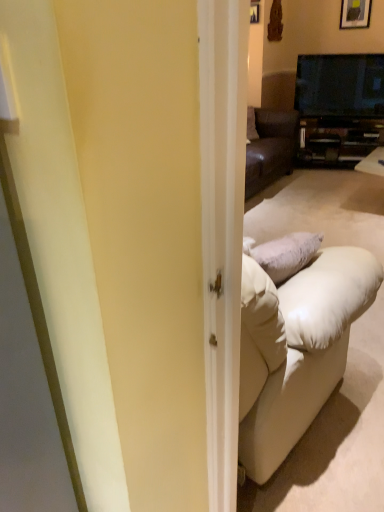
Question: Is black glossy tv at upper right in front of or behind wooden framed picture at upper right in the image?

Choices:
 (A) behind
 (B) front

Answer: (B)

Question: From the image's perspective, relative to wooden framed picture at upper right, is black glossy tv at upper right above or below?

Choices:
 (A) below
 (B) above

Answer: (A)

Question: Estimate the real-world distances between objects in this image. Which object is closer to the matte black cabinet at center?

Choices:
 (A) wooden framed picture at upper right
 (B) black glossy tv at upper right

Answer: (B)

Question: Estimate the real-world distances between objects in this image. Which object is farther from the wooden framed picture at upper right?

Choices:
 (A) black glossy tv at upper right
 (B) matte black cabinet at center

Answer: (B)